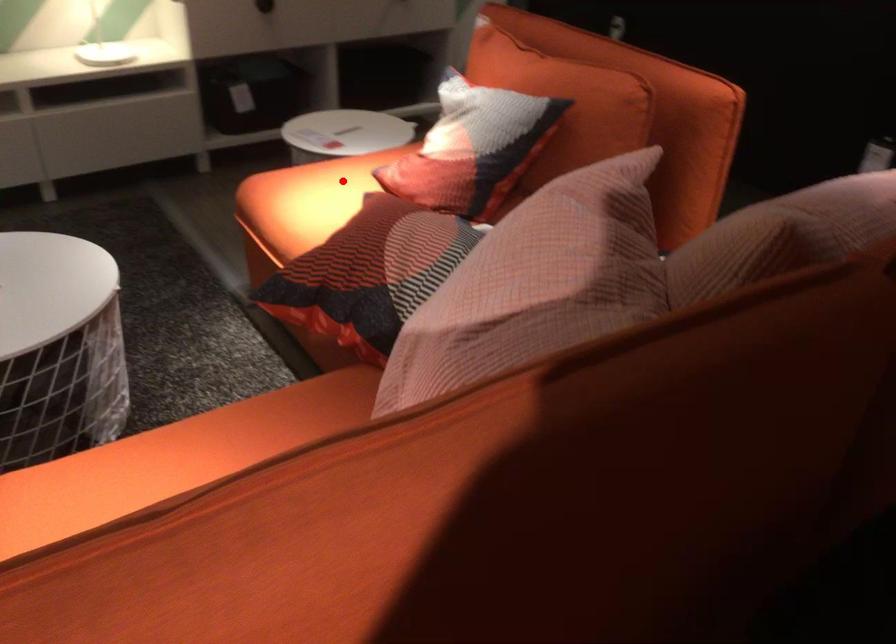
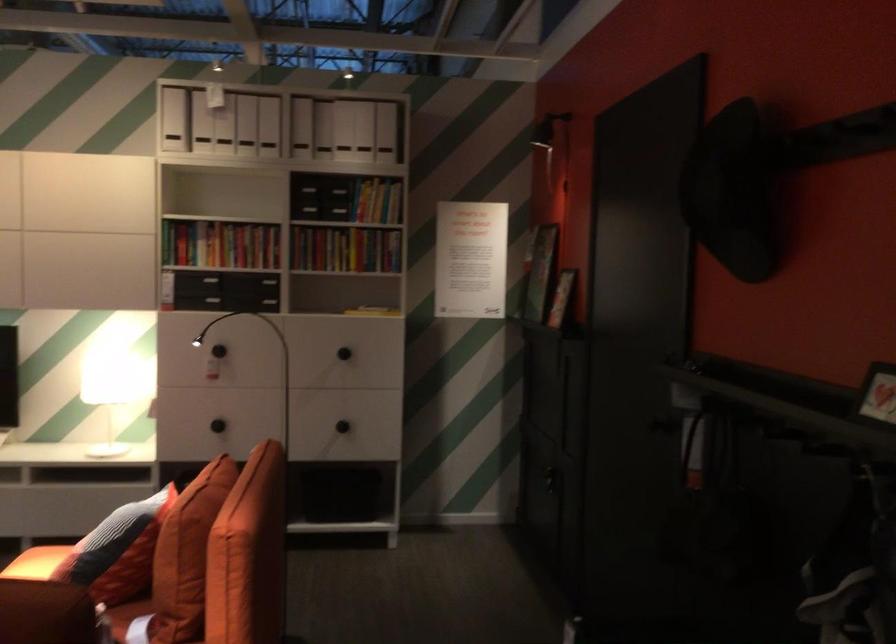
Question: A red point is marked in image1. In image2, is the corresponding 3D point closer to the camera or farther? Reply with the corresponding letter.

Choices:
 (A) The corresponding 3D point is closer.
 (B) The corresponding 3D point is farther.

Answer: (B)